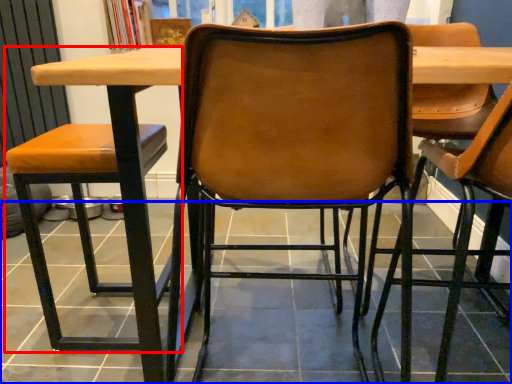
Question: Among these objects, which one is nearest to the camera, chair (highlighted by a red box) or tile (highlighted by a blue box)?

Choices:
 (A) chair
 (B) tile

Answer: (A)